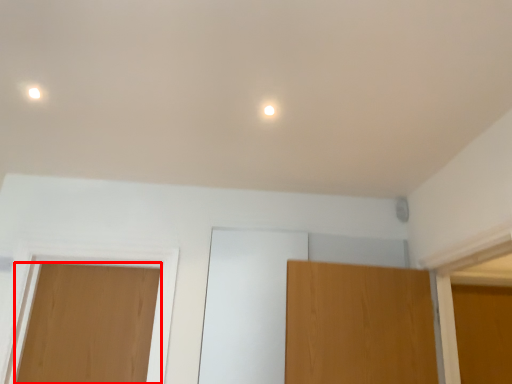
Question: From the image's perspective, what is the correct spatial relationship of door (annotated by the red box) in relation to dot?

Choices:
 (A) below
 (B) above

Answer: (A)